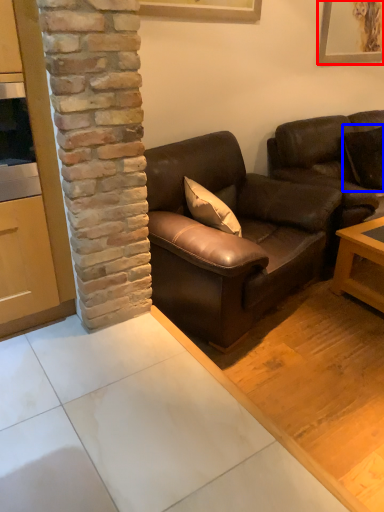
Question: Which object is further to the camera taking this photo, picture frame (highlighted by a red box) or pillow (highlighted by a blue box)?

Choices:
 (A) picture frame
 (B) pillow

Answer: (A)